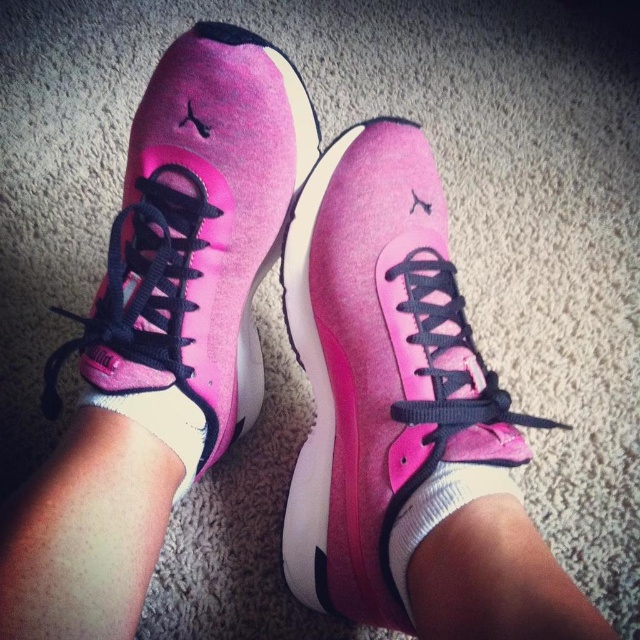
You are a delivery robot with a height of 24 inches. You need to deliver a package to the pink suede sneaker at center. Can you safely place the package on the floor without hitting your head?

The distance of pink suede sneaker at center from viewer is 20.82 inches. Since the robot is 24 inches tall, it would hit its head if it approaches closer than 20.82 inches. Therefore, the robot cannot safely place the package on the floor without risking a collision.

You are trying to decide which sock to wear with your sneakers. You see the white soft sock at lower center and the white cotton sock at center. Which sock is positioned lower on your foot?

The white soft sock at lower center is positioned lower on the foot compared to the white cotton sock at center.

You are organizing a drawer and have two socks to place. You have a white soft sock at lower center and a white cotton sock at center. Which sock takes up more space in the drawer?

The white cotton sock at center occupies more space than the white soft sock at lower center because the white soft sock at lower center occupies less space than white cotton sock at center.